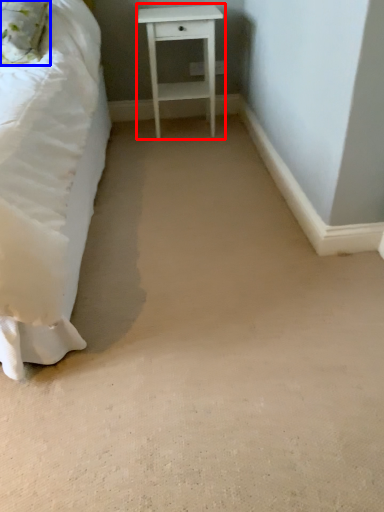
Question: Which point is further to the camera, nightstand (highlighted by a red box) or pillow (highlighted by a blue box)?

Choices:
 (A) nightstand
 (B) pillow

Answer: (A)